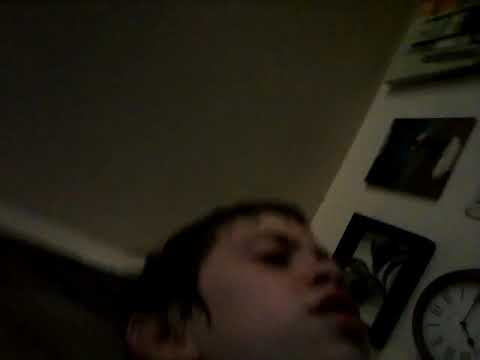
Identify the location of white wall. (424, 216).